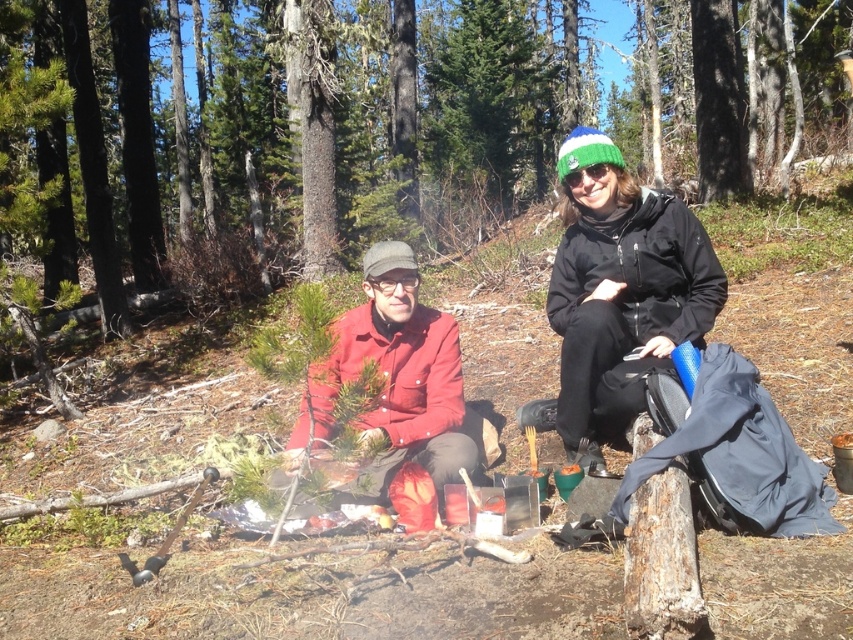
Who is positioned more to the right, red matte shirt at center or matte red shirt at center?

Positioned to the right is red matte shirt at center.

Find the location of `red matte shirt at center`. red matte shirt at center is located at coordinates (619, 291).

Can you confirm if red matte shirt at center is taller than black matte jacket at center?

Correct, red matte shirt at center is much taller as black matte jacket at center.

What do you see at coordinates (619, 291) in the screenshot?
I see `red matte shirt at center` at bounding box center [619, 291].

Locate an element on the screen. The image size is (853, 640). red matte shirt at center is located at coordinates (619, 291).

Can you confirm if black matte jacket at center is bigger than matte red shirt at center?

No.

Between black matte jacket at center and matte red shirt at center, which one is positioned lower?

Positioned lower is matte red shirt at center.

Is point (691, 234) positioned before point (424, 308)?

That is True.

Identify the location of black matte jacket at center. Image resolution: width=853 pixels, height=640 pixels. (619, 291).